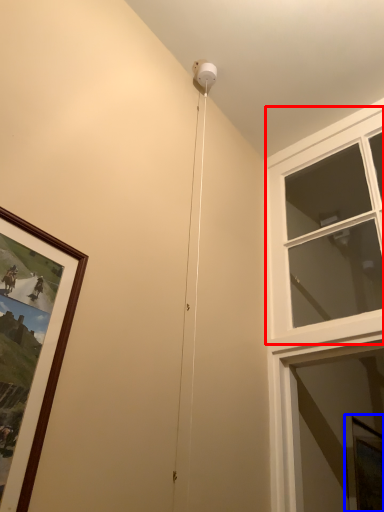
Question: Which point is further to the camera, window (highlighted by a red box) or window screen (highlighted by a blue box)?

Choices:
 (A) window
 (B) window screen

Answer: (B)